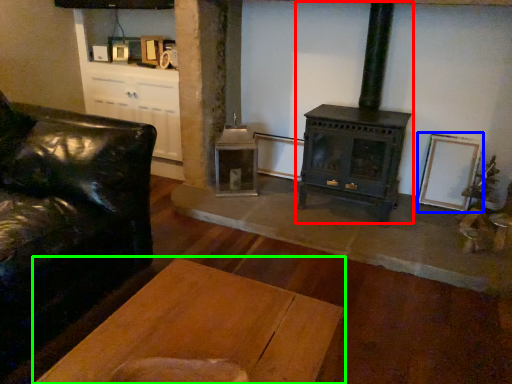
Question: Which object is positioned closest to wood burning stove (highlighted by a red box)? Select from picture frame (highlighted by a blue box) and table (highlighted by a green box).

Choices:
 (A) picture frame
 (B) table

Answer: (A)